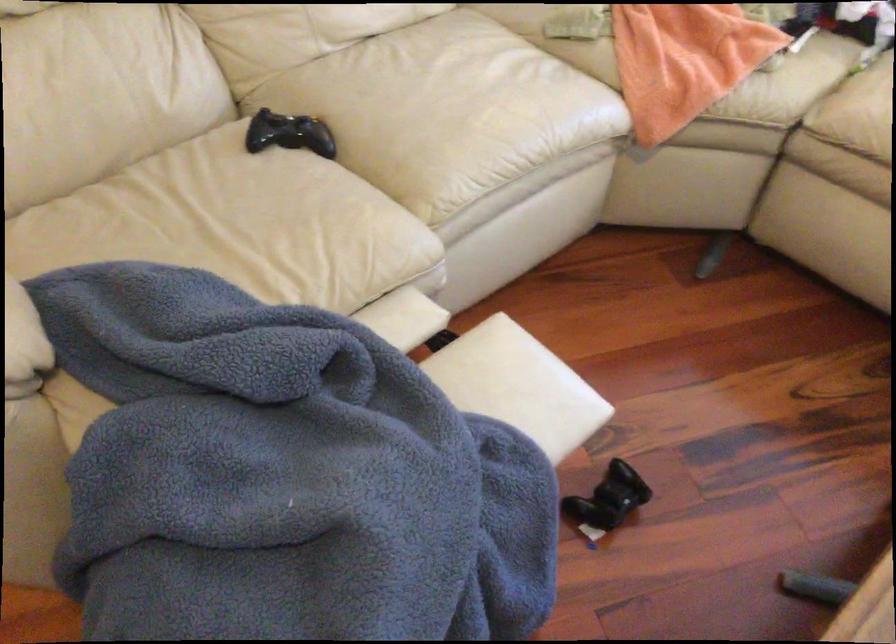
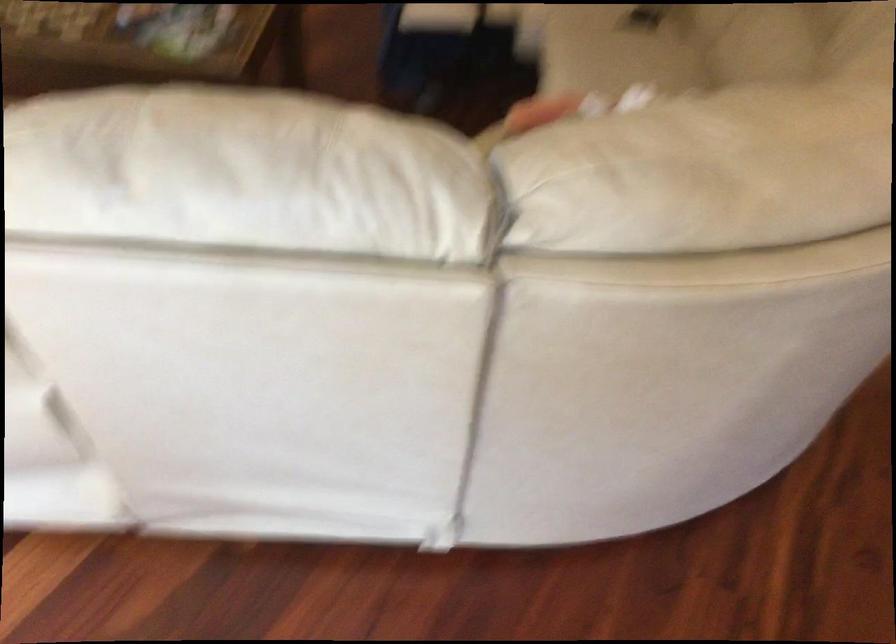
Find the pixel in the second image that matches pixel 468 93 in the first image.

(616, 49)